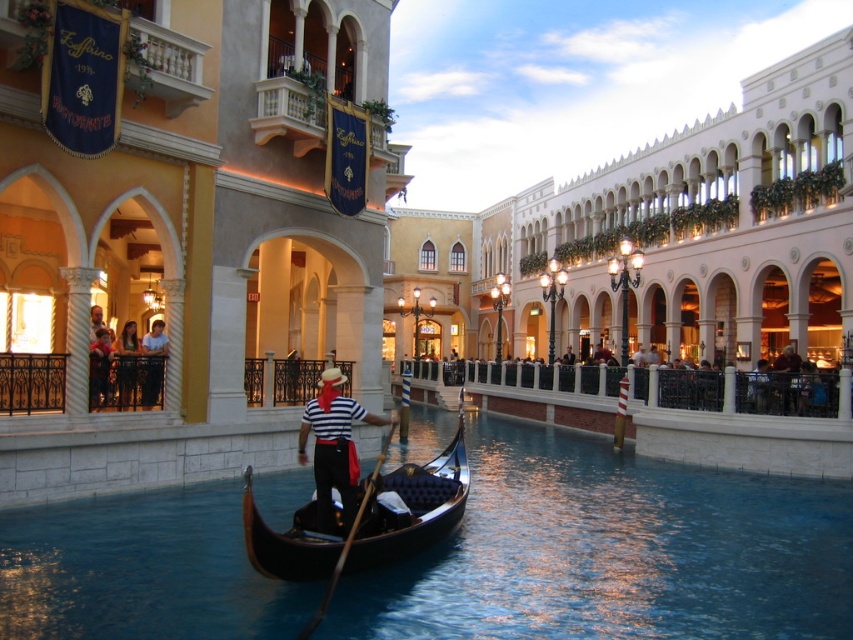
You are standing on the dock near the black polished gondola at center. If you walk straight ahead, which direction would you face relative to the gondola?

Since the black polished gondola at center is located at point (366, 518), walking straight ahead from the dock would mean facing away from the gondola.

You are a tourist standing on the canal bridge and want to take a photo of the black glossy water at center and the white cotton shirt at center. Which object should you focus on first if you want to capture both in one frame without moving the camera?

You should focus on the white cotton shirt at center first because it is taller than the black glossy water at center, allowing you to adjust the camera angle to include both in the frame.